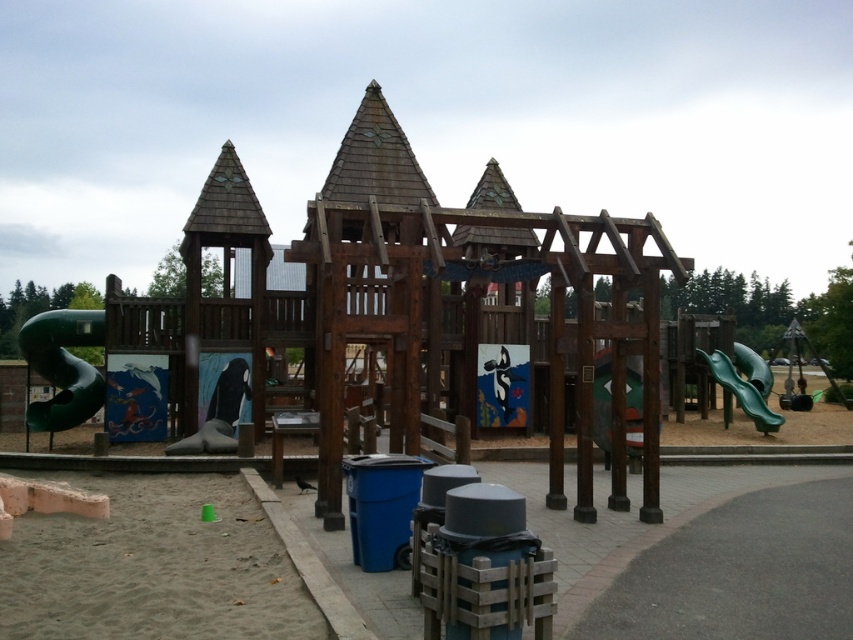
Can you confirm if sandy beige sand at lower left is shorter than matte black slide at center?

Yes.

What do you see at coordinates (154, 566) in the screenshot?
I see `sandy beige sand at lower left` at bounding box center [154, 566].

Which is in front, point (122, 513) or point (248, 416)?

Point (122, 513) is in front.

The height and width of the screenshot is (640, 853). I want to click on sandy beige sand at lower left, so click(x=154, y=566).

Does green matte slide at left have a lesser height compared to green plastic slide at right?

In fact, green matte slide at left may be taller than green plastic slide at right.

Who is more forward, (x=39, y=353) or (x=753, y=369)?

Point (x=39, y=353) is in front.

The height and width of the screenshot is (640, 853). In order to click on green matte slide at left in this screenshot , I will do `click(62, 365)`.

Is sandy beige sand at lower left to the left of green matte slide at left from the viewer's perspective?

In fact, sandy beige sand at lower left is to the right of green matte slide at left.

Between point (12, 536) and point (59, 426), which one is positioned in front?

Point (12, 536) is in front.

Find the location of a particular element. sandy beige sand at lower left is located at coordinates (154, 566).